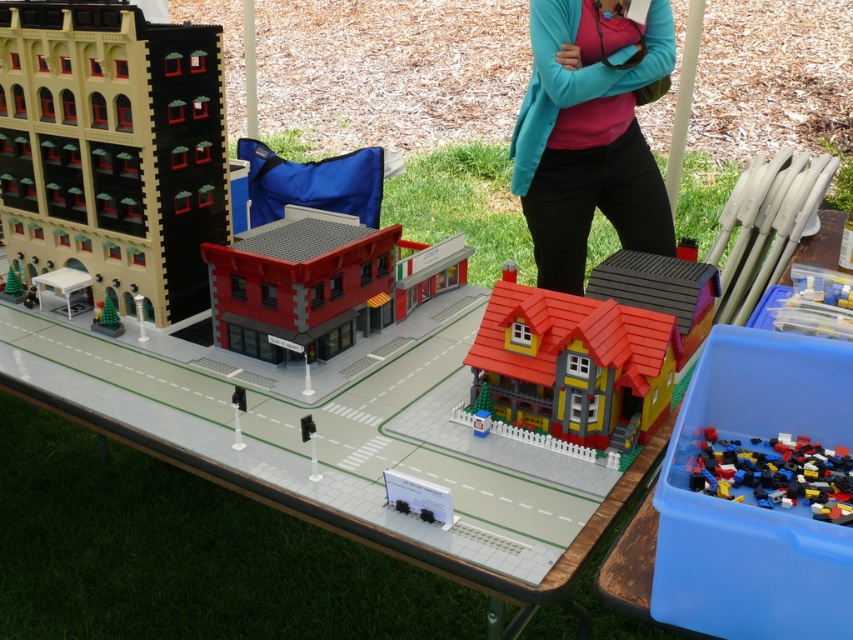
Which is behind, point (146, 182) or point (537, 406)?

The point (146, 182) is behind.

Which of these two, matte yellow building at left or matte yellow house at center, stands taller?

With more height is matte yellow building at left.

You are a GUI agent. You are given a task and a screenshot of the screen. Output one action in this format:
    pyautogui.click(x=<x>, y=<y>)
    Task: Click on the matte yellow building at left
    Image resolution: width=853 pixels, height=640 pixels.
    Given the screenshot: What is the action you would take?
    pyautogui.click(x=112, y=148)

Consider the image. Between white plastic table at lower left and green matte christmas tree at lower left, which one appears on the left side from the viewer's perspective?

white plastic table at lower left is more to the left.

Between point (73, 289) and point (119, 330), which one is positioned in front?

Point (119, 330) is in front.

This screenshot has width=853, height=640. In order to click on white plastic table at lower left in this screenshot , I will do `click(62, 282)`.

The image size is (853, 640). I want to click on brick-like plastic bricks at lower right, so click(776, 474).

Between brick-like plastic bricks at lower right and white plastic table at lower left, which one has less height?

Standing shorter between the two is brick-like plastic bricks at lower right.

Which is behind, point (770, 481) or point (62, 268)?

Positioned behind is point (62, 268).

At what (x,y) coordinates should I click in order to perform the action: click on brick-like plastic bricks at lower right. Please return your answer as a coordinate pair (x, y). This screenshot has width=853, height=640. Looking at the image, I should click on (776, 474).